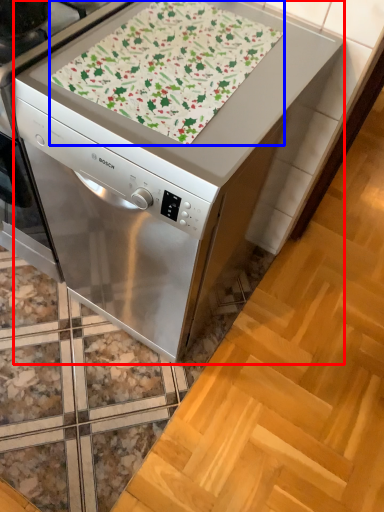
Question: Which object appears farthest to the camera in this image, home appliance (highlighted by a red box) or blanket (highlighted by a blue box)?

Choices:
 (A) home appliance
 (B) blanket

Answer: (B)